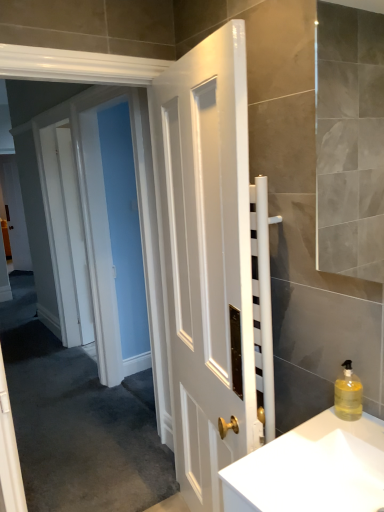
Question: Is translucent yellow liquid at right next to white glossy sink at lower right?

Choices:
 (A) yes
 (B) no

Answer: (B)

Question: Does translucent yellow liquid at right have a lesser width compared to white glossy sink at lower right?

Choices:
 (A) yes
 (B) no

Answer: (A)

Question: Is translucent yellow liquid at right outside of white glossy sink at lower right?

Choices:
 (A) no
 (B) yes

Answer: (B)

Question: Does translucent yellow liquid at right turn towards white glossy sink at lower right?

Choices:
 (A) no
 (B) yes

Answer: (A)

Question: From a real-world perspective, does translucent yellow liquid at right stand above white glossy sink at lower right?

Choices:
 (A) yes
 (B) no

Answer: (A)

Question: Does point (355, 404) appear closer or farther from the camera than point (367, 416)?

Choices:
 (A) closer
 (B) farther

Answer: (A)

Question: Is translucent yellow liquid at right taller or shorter than white glossy sink at lower right?

Choices:
 (A) tall
 (B) short

Answer: (A)

Question: Is translucent yellow liquid at right bigger or smaller than white glossy sink at lower right?

Choices:
 (A) big
 (B) small

Answer: (B)

Question: From the image's perspective, is translucent yellow liquid at right above or below white glossy sink at lower right?

Choices:
 (A) below
 (B) above

Answer: (B)

Question: From the image's perspective, is white glossy door at left located above or below translucent yellow liquid at right?

Choices:
 (A) below
 (B) above

Answer: (B)

Question: From a real-world perspective, is white glossy door at left physically located above or below translucent yellow liquid at right?

Choices:
 (A) below
 (B) above

Answer: (B)

Question: In the image, is white glossy door at left positioned in front of or behind translucent yellow liquid at right?

Choices:
 (A) front
 (B) behind

Answer: (B)

Question: Is point (71, 238) closer or farther from the camera than point (349, 375)?

Choices:
 (A) farther
 (B) closer

Answer: (A)

Question: Is point (370, 418) positioned closer to the camera than point (347, 364)?

Choices:
 (A) closer
 (B) farther

Answer: (A)

Question: Considering the positions of white glossy sink at lower right and translucent yellow liquid at right in the image, is white glossy sink at lower right wider or thinner than translucent yellow liquid at right?

Choices:
 (A) thin
 (B) wide

Answer: (B)